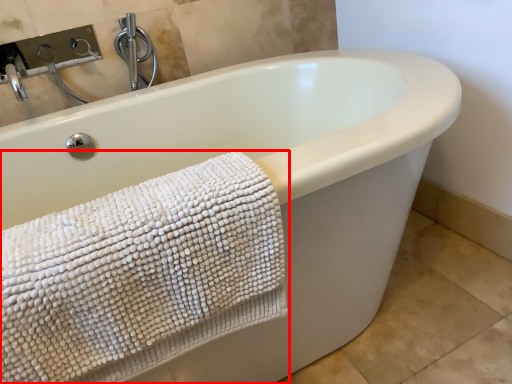
Question: From the image's perspective, where is towel (annotated by the red box) located relative to faucet?

Choices:
 (A) below
 (B) above

Answer: (A)